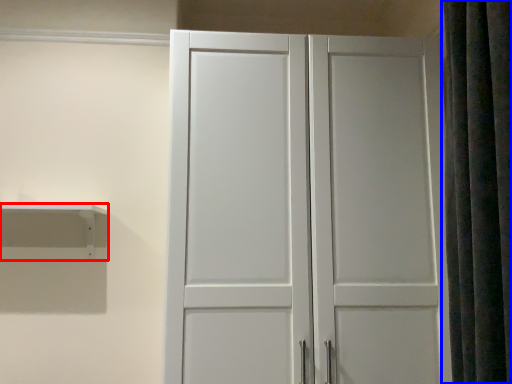
Question: Which point is closer to the camera, shelf (highlighted by a red box) or shower curtain (highlighted by a blue box)?

Choices:
 (A) shelf
 (B) shower curtain

Answer: (B)